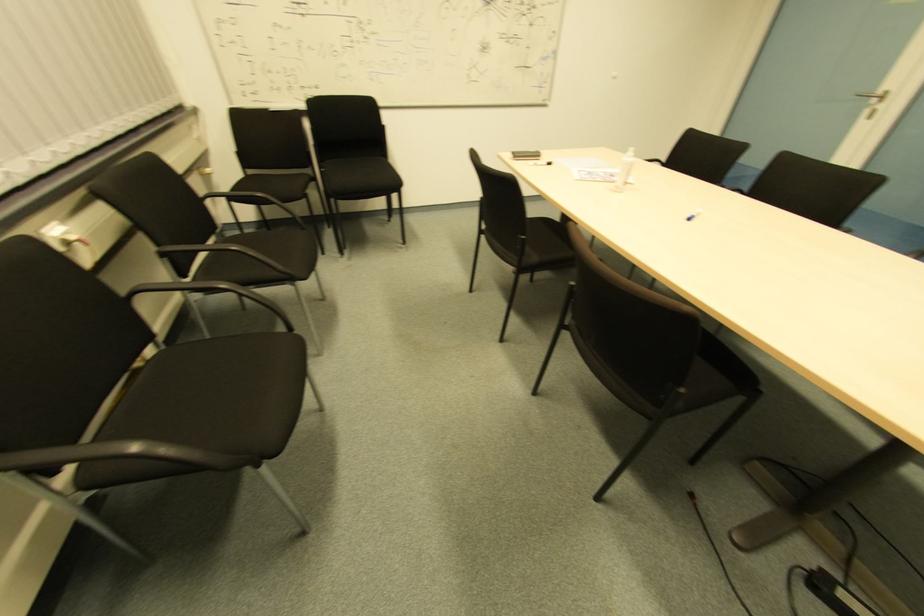
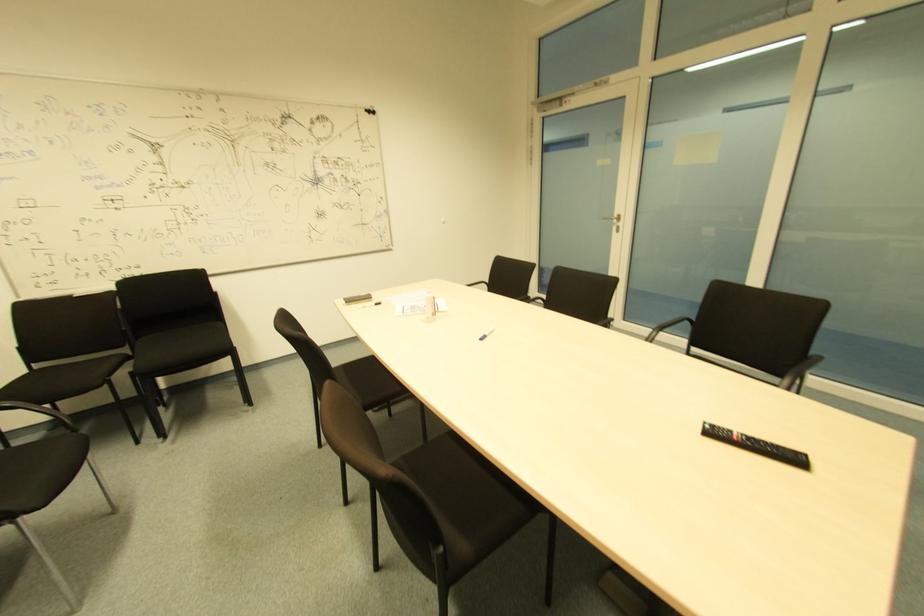
Where in the second image is the point corresponding to [536,158] from the first image?

(365, 301)